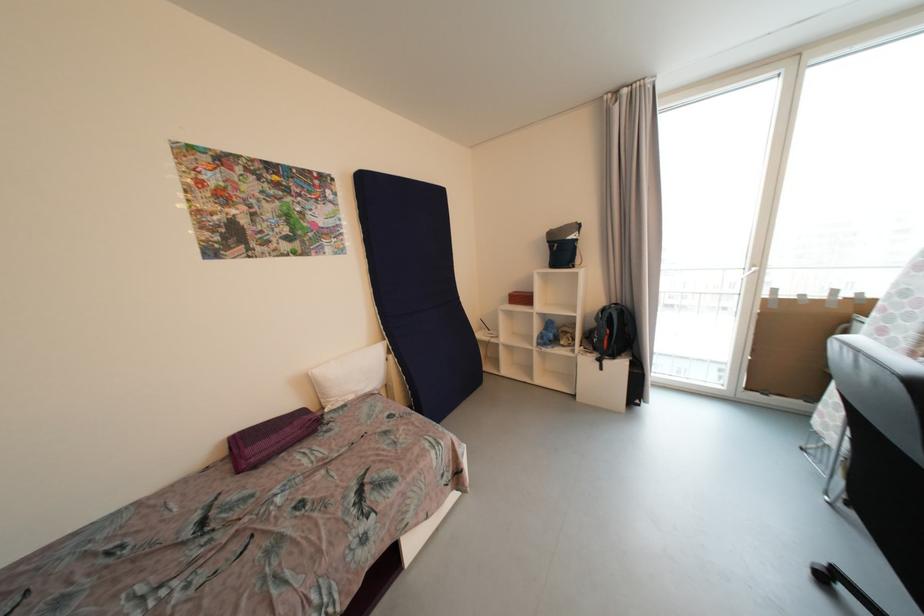
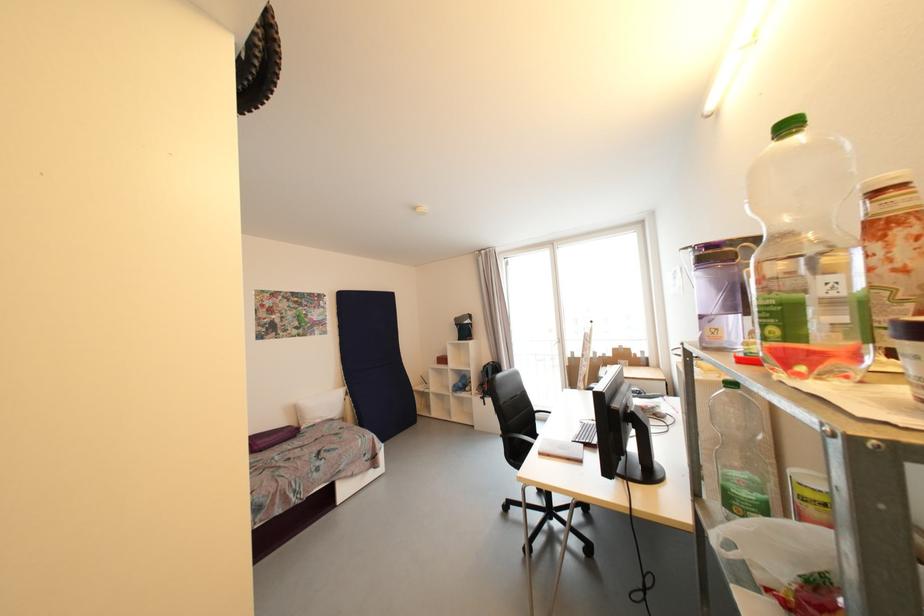
Locate, in the second image, the point that corresponds to (x=254, y=453) in the first image.

(263, 445)